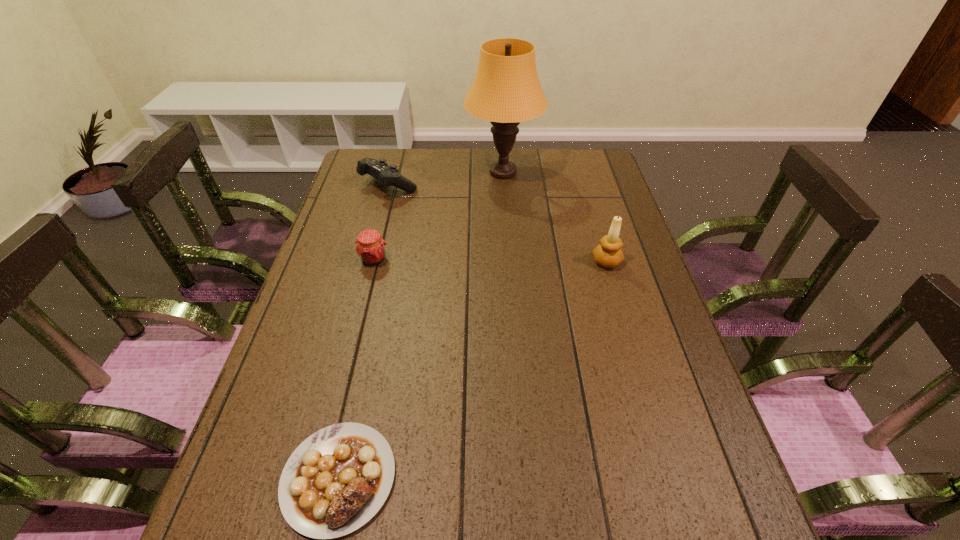
You are a GUI agent. You are given a task and a screenshot of the screen. Output one action in this format:
    pyautogui.click(x=<x>, y=<y>)
    Task: Click on the vacant space at the far left corner of the desktop
    The height and width of the screenshot is (540, 960).
    Given the screenshot: What is the action you would take?
    pyautogui.click(x=365, y=176)

In the image, there is a desktop. Where is `free space at the far right corner`? free space at the far right corner is located at coordinates (584, 174).

In order to click on free area in between the jam and the control in this screenshot , I will do `click(381, 222)`.

Find the location of `vacant point located between the control and the second object from right to left`. vacant point located between the control and the second object from right to left is located at coordinates (446, 179).

Select which object is the closest to the steak. Please provide its 2D coordinates. Your answer should be formatted as a tuple, i.e. [(x, y)], where the tuple contains the x and y coordinates of a point satisfying the conditions above.

[(370, 247)]

Identify which object is the nearest to the jam. Please provide its 2D coordinates. Your answer should be formatted as a tuple, i.e. [(x, y)], where the tuple contains the x and y coordinates of a point satisfying the conditions above.

[(387, 176)]